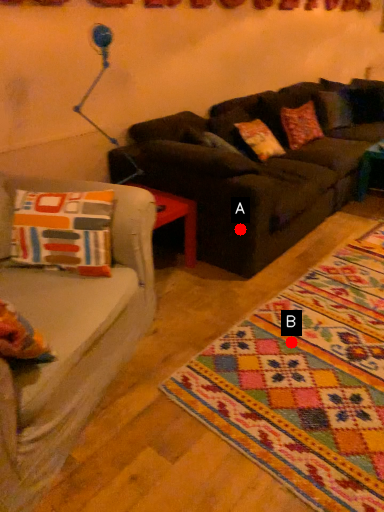
Question: Two points are circled on the image, labeled by A and B beside each circle. Which point is farther from the camera taking this photo?

Choices:
 (A) A is further
 (B) B is further

Answer: (A)